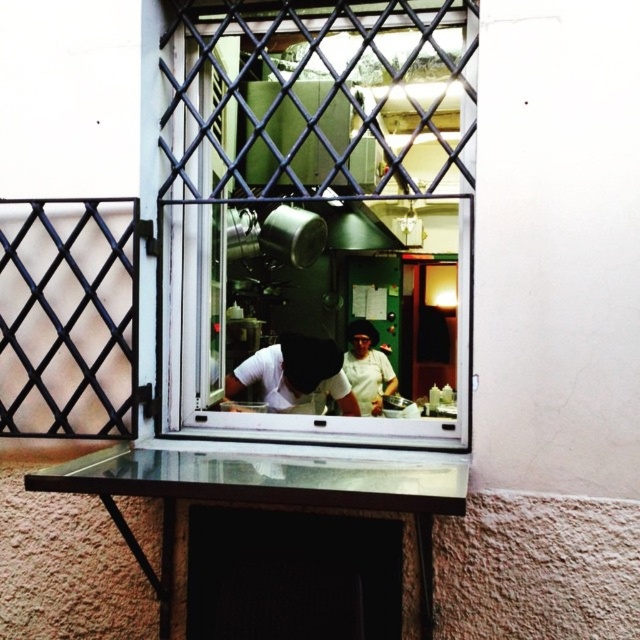
Is white matte shirt at center above white fabric chef at center?

Actually, white matte shirt at center is below white fabric chef at center.

Is white matte shirt at center wider than white fabric chef at center?

Yes.

The height and width of the screenshot is (640, 640). In order to click on white matte shirt at center in this screenshot , I will do `click(296, 372)`.

Is clear glass window at center smaller than white matte shirt at center?

No.

Does clear glass window at center have a lesser width compared to white matte shirt at center?

In fact, clear glass window at center might be wider than white matte shirt at center.

Does point (216, 378) come in front of point (310, 355)?

That is False.

The image size is (640, 640). I want to click on clear glass window at center, so click(x=316, y=192).

Can you confirm if clear glass window at center is taller than white fabric chef at center?

Indeed, clear glass window at center has a greater height compared to white fabric chef at center.

Is point (209, 81) farther from camera compared to point (364, 330)?

Yes, it is.

The image size is (640, 640). I want to click on clear glass window at center, so (316, 192).